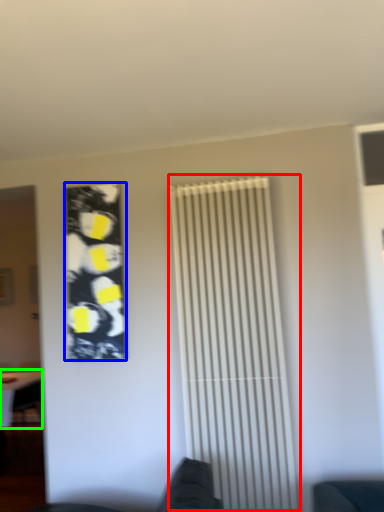
Question: Based on their relative distances, which object is farther from shutter (highlighted by a red box)? Choose from poster (highlighted by a blue box) and table (highlighted by a green box).

Choices:
 (A) poster
 (B) table

Answer: (B)